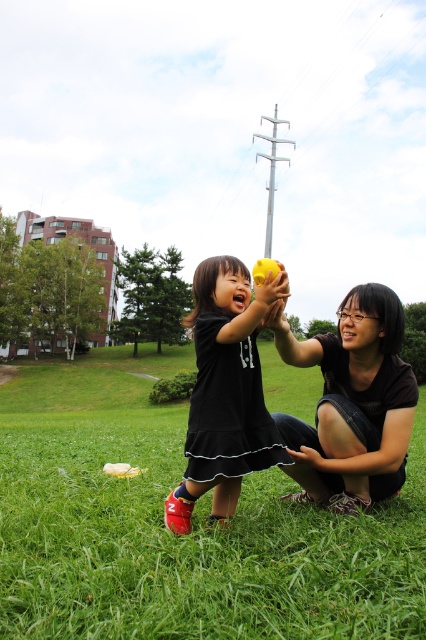
You are standing in the park and see two points in the scene. Which point is closer to you, point (x=417, y=518) or point (x=397, y=467)?

Point (x=397, y=467) is closer to you because it is less further to the camera than point (x=417, y=518).

You are a parent trying to find the matte yellow ball at center for your child. Where would you look relative to the green grass at center?

The matte yellow ball at center is smaller than the green grass at center, so it should be located within or among the green grass at center since the grass is larger in size.

From the picture: You are a parent trying to throw a matte yellow ball at center to your child who is standing on green grass at center. The ball travels in a straight line. Is the ball likely to hit the child?

The distance between green grass at center and matte yellow ball at center is 17.76 meters. Since the ball travels in a straight line, it would have to cover a significant distance, making it unlikely to hit the child unless thrown with great force. However, typical throwing distances for a parent are much shorter, so the ball is unlikely to hit the child.